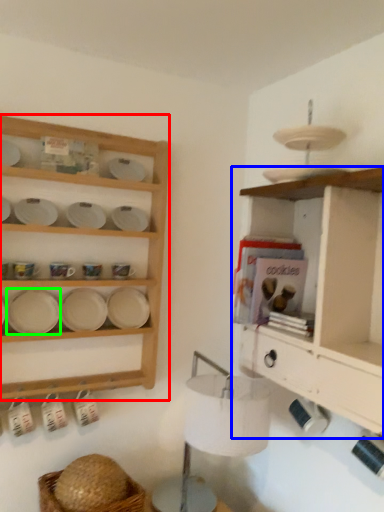
Question: Based on their relative distances, which object is farther from shelf (highlighted by a red box)? Choose from shelf (highlighted by a blue box) and platter (highlighted by a green box).

Choices:
 (A) shelf
 (B) platter

Answer: (A)